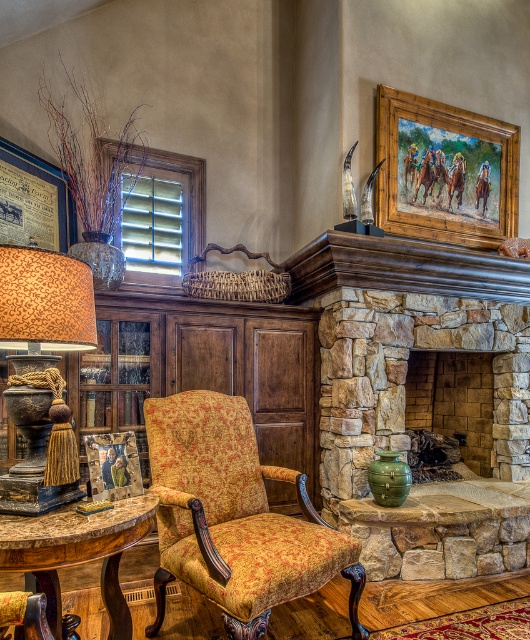
You are sitting in the patterned fabric armchair at center and want to place a book on the rustic wood table at lower left. Can you reach the table without getting up?

The distance between the patterned fabric armchair at center and the rustic wood table at lower left is 16.59 inches. Since this distance is within typical arm reach, you can likely place the book on the table without getting up.

You are sitting in the patterned fabric armchair at center and want to take a photo of the fireplace using a camera. Can you reach the camera without getting up?

The patterned fabric armchair at center and camera are 5.70 feet apart from each other. Since the distance is too far to reach, you would need to get up to grab the camera.

You are sitting on the floor and want to place a book from the rustic wood table at lower left onto the patterned fabric armchair at center. Is the armchair higher than the table?

The patterned fabric armchair at center has a greater height compared to rustic wood table at lower left, so yes, the armchair is higher than the table.